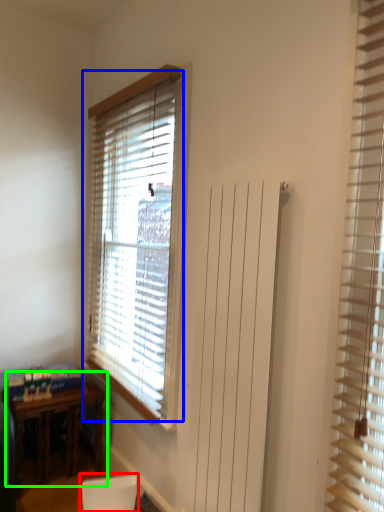
Question: Estimate the real-world distances between objects in this image. Which object is closer to armchair (highlighted by a red box), window blind (highlighted by a blue box) or table (highlighted by a green box)?

Choices:
 (A) window blind
 (B) table

Answer: (B)